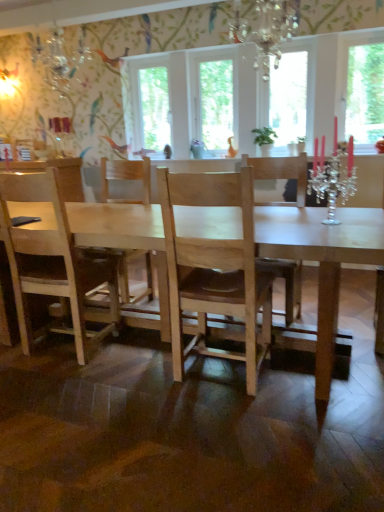
Where is `vacant space situated above transparent glass window at center, marked as the 2th window screen in a left-to-right arrangement (from a real-world perspective)`? Image resolution: width=384 pixels, height=512 pixels. vacant space situated above transparent glass window at center, marked as the 2th window screen in a left-to-right arrangement (from a real-world perspective) is located at coordinates (213, 52).